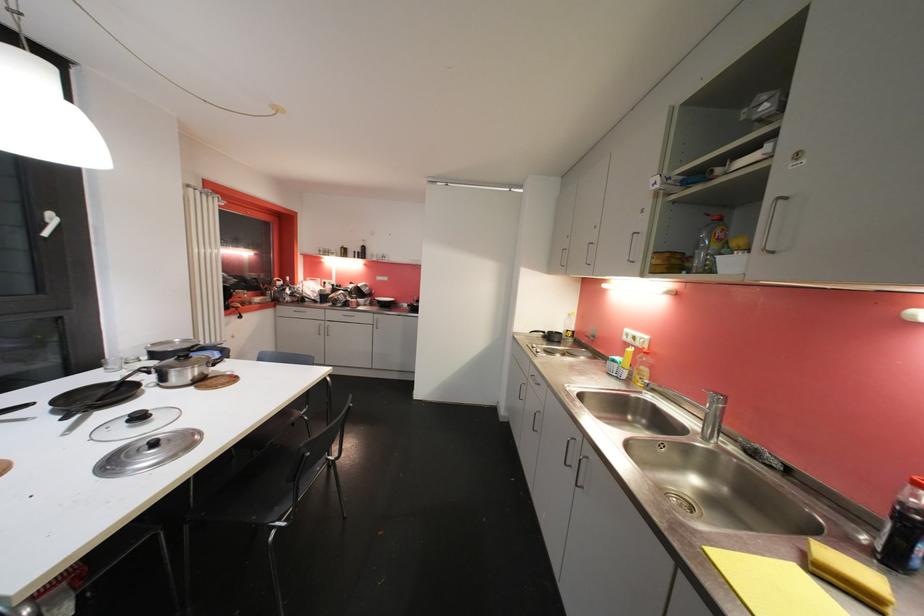
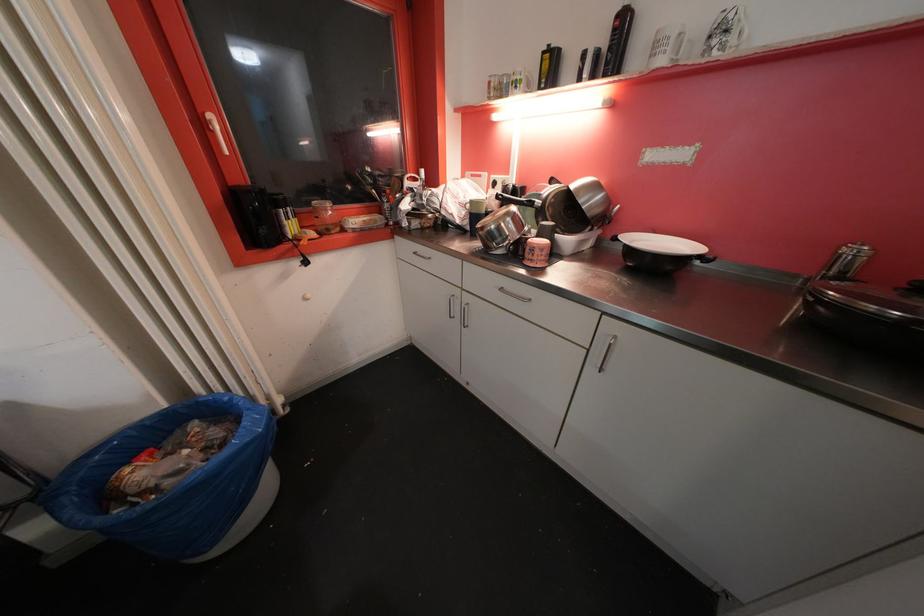
Where in the second image is the point corresponding to point 369,251 from the first image?

(628, 25)